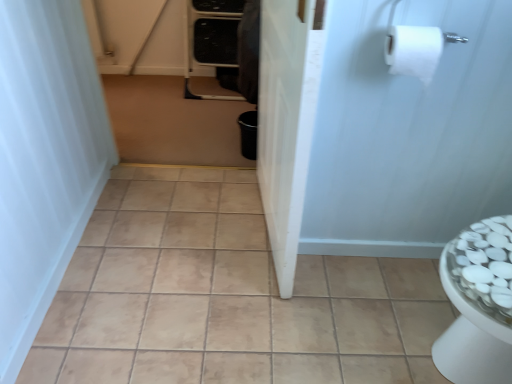
Question: Does white matte screen door at upper right, which ranks as the 2th screen door in left-to-right order, have a greater width compared to white glossy screen door at center, acting as the first screen door starting from the left?

Choices:
 (A) yes
 (B) no

Answer: (B)

Question: Is white matte screen door at upper right, which ranks as the 2th screen door in left-to-right order, outside of white glossy screen door at center, acting as the first screen door starting from the left?

Choices:
 (A) yes
 (B) no

Answer: (A)

Question: Is the depth of white matte screen door at upper right, which ranks as the 2th screen door in left-to-right order, less than that of white glossy screen door at center, acting as the first screen door starting from the left?

Choices:
 (A) no
 (B) yes

Answer: (A)

Question: Does white matte screen door at upper right, which ranks as the 2th screen door in left-to-right order, have a larger size compared to white glossy screen door at center, acting as the first screen door starting from the left?

Choices:
 (A) yes
 (B) no

Answer: (B)

Question: Is white matte screen door at upper right, which is counted as the first screen door, starting from the right, positioned far away from white glossy screen door at center, which is counted as the second screen door, starting from the right?

Choices:
 (A) yes
 (B) no

Answer: (B)

Question: Can you confirm if white matte screen door at upper right, which is counted as the first screen door, starting from the right, is thinner than white glossy screen door at center, acting as the first screen door starting from the left?

Choices:
 (A) yes
 (B) no

Answer: (A)

Question: Are beige ceramic tile at center and white glossy screen door at center, which is counted as the second screen door, starting from the right, far apart?

Choices:
 (A) no
 (B) yes

Answer: (A)

Question: Does beige ceramic tile at center have a larger size compared to white glossy screen door at center, which is counted as the second screen door, starting from the right?

Choices:
 (A) no
 (B) yes

Answer: (A)

Question: Does beige ceramic tile at center lie in front of white glossy screen door at center, which is counted as the second screen door, starting from the right?

Choices:
 (A) no
 (B) yes

Answer: (A)

Question: Does beige ceramic tile at center have a greater height compared to white glossy screen door at center, acting as the first screen door starting from the left?

Choices:
 (A) no
 (B) yes

Answer: (A)

Question: Could you tell me if beige ceramic tile at center is turned towards white glossy screen door at center, acting as the first screen door starting from the left?

Choices:
 (A) yes
 (B) no

Answer: (B)

Question: Is beige ceramic tile at center thinner than white glossy screen door at center, acting as the first screen door starting from the left?

Choices:
 (A) no
 (B) yes

Answer: (A)

Question: Is white matte shower curtain at left taller than white matte toilet paper at upper right?

Choices:
 (A) yes
 (B) no

Answer: (A)